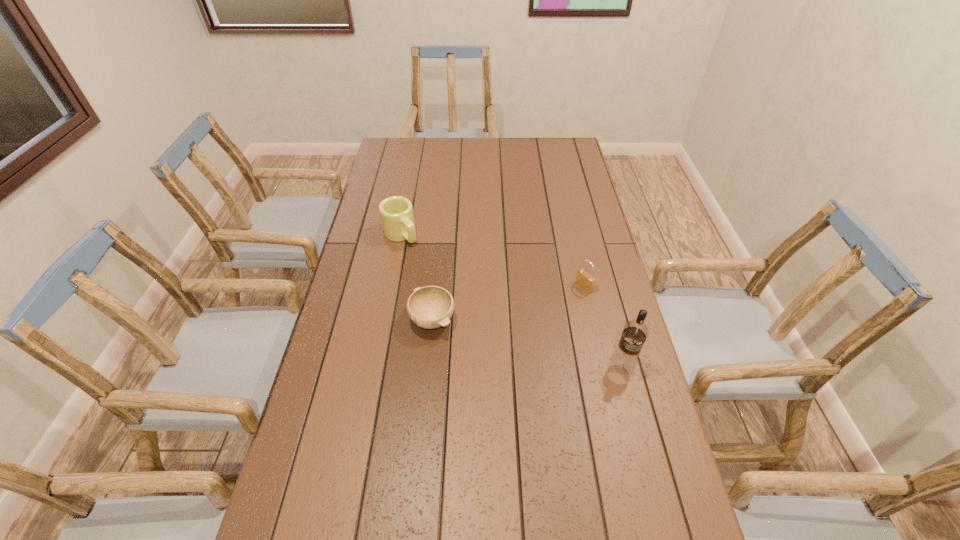
This screenshot has width=960, height=540. In order to click on vacant area that lies between the leftmost object and the padlock in this screenshot , I will do 492,260.

Where is `free point between the shortest object and the third nearest object`? The height and width of the screenshot is (540, 960). free point between the shortest object and the third nearest object is located at coordinates (508, 303).

Image resolution: width=960 pixels, height=540 pixels. In order to click on free space between the nearest object and the mug in this screenshot , I will do `click(512, 299)`.

Where is `free space between the tallest object and the mug`? The width and height of the screenshot is (960, 540). free space between the tallest object and the mug is located at coordinates (512, 299).

Locate which object is the closest to the shortest object. Please provide its 2D coordinates. Your answer should be formatted as a tuple, i.e. [(x, y)], where the tuple contains the x and y coordinates of a point satisfying the conditions above.

[(396, 213)]

Locate which object ranks in proximity to the bowl. Please provide its 2D coordinates. Your answer should be formatted as a tuple, i.e. [(x, y)], where the tuple contains the x and y coordinates of a point satisfying the conditions above.

[(396, 213)]

Where is `free spot that satisfies the following two spatial constraints: 1. on the front side of the leftmost object; 2. on the left side of the third object from right to left`? The width and height of the screenshot is (960, 540). free spot that satisfies the following two spatial constraints: 1. on the front side of the leftmost object; 2. on the left side of the third object from right to left is located at coordinates (385, 320).

This screenshot has width=960, height=540. I want to click on vacant space that satisfies the following two spatial constraints: 1. on the back side of the padlock; 2. on the left side of the shortest object, so click(x=436, y=286).

Where is `vacant region that satisfies the following two spatial constraints: 1. on the back side of the padlock; 2. on the right side of the bowl`? The image size is (960, 540). vacant region that satisfies the following two spatial constraints: 1. on the back side of the padlock; 2. on the right side of the bowl is located at coordinates (436, 286).

The height and width of the screenshot is (540, 960). What are the coordinates of `free region that satisfies the following two spatial constraints: 1. on the back side of the padlock; 2. on the right side of the second object from left to right` in the screenshot? It's located at (436, 286).